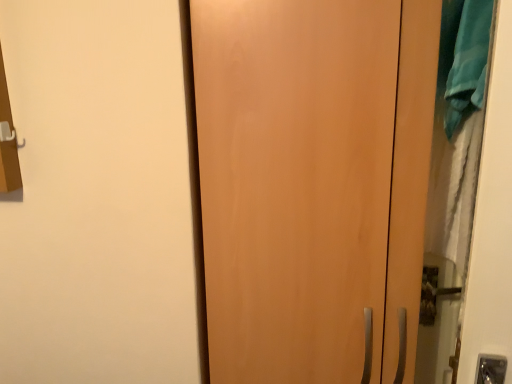
Describe the element at coordinates (314, 184) in the screenshot. I see `matte wood door at center` at that location.

Where is `matte wood door at center`? The width and height of the screenshot is (512, 384). matte wood door at center is located at coordinates [314, 184].

You are a GUI agent. You are given a task and a screenshot of the screen. Output one action in this format:
    pyautogui.click(x=<x>, y=<y>)
    Task: Click on the matte wood door at center
    This screenshot has height=384, width=512.
    Given the screenshot: What is the action you would take?
    pyautogui.click(x=314, y=184)